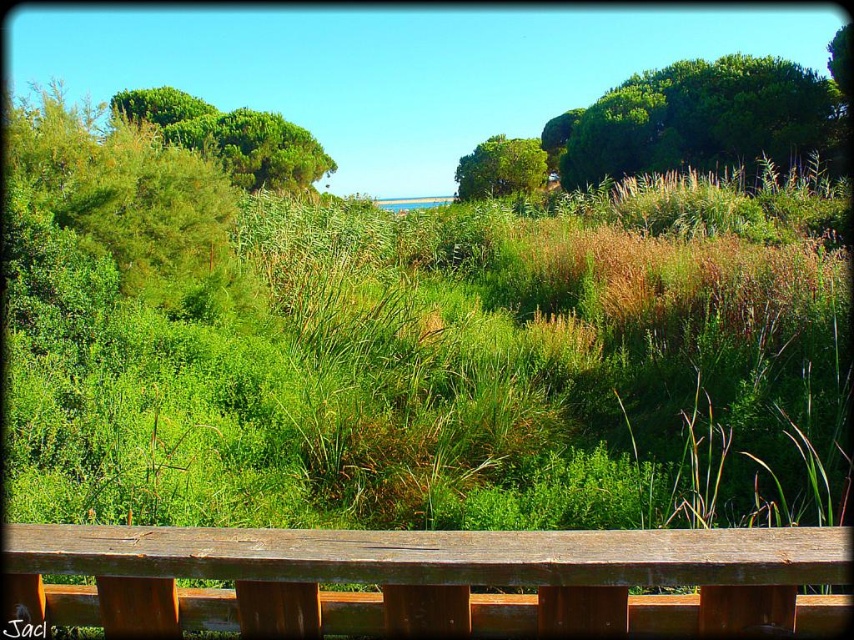
Question: Is weathered wood picnic table at center wider than green leafy tree at upper left?

Choices:
 (A) no
 (B) yes

Answer: (A)

Question: Is the position of weathered wood picnic table at center less distant than that of green leafy tree at upper left?

Choices:
 (A) no
 (B) yes

Answer: (B)

Question: Which of the following is the closest to the observer?

Choices:
 (A) (487, 557)
 (B) (326, 157)
 (C) (486, 177)

Answer: (A)

Question: Based on their relative distances, which object is farther from the green leafy tree at upper right?

Choices:
 (A) weathered wood picnic table at center
 (B) green leafy tree at upper left

Answer: (A)

Question: Which object is positioned farthest from the green leafy tree at upper left?

Choices:
 (A) weathered wood picnic table at center
 (B) green leafy tree at upper right

Answer: (A)

Question: Can you confirm if green leafy tree at upper left is wider than green leafy tree at center?

Choices:
 (A) no
 (B) yes

Answer: (B)